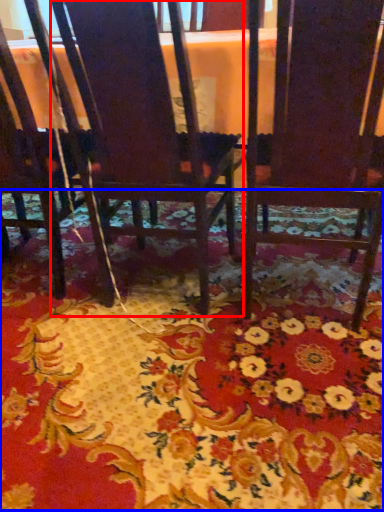
Question: Which object appears farthest to the camera in this image, chair (highlighted by a red box) or mat (highlighted by a blue box)?

Choices:
 (A) chair
 (B) mat

Answer: (A)